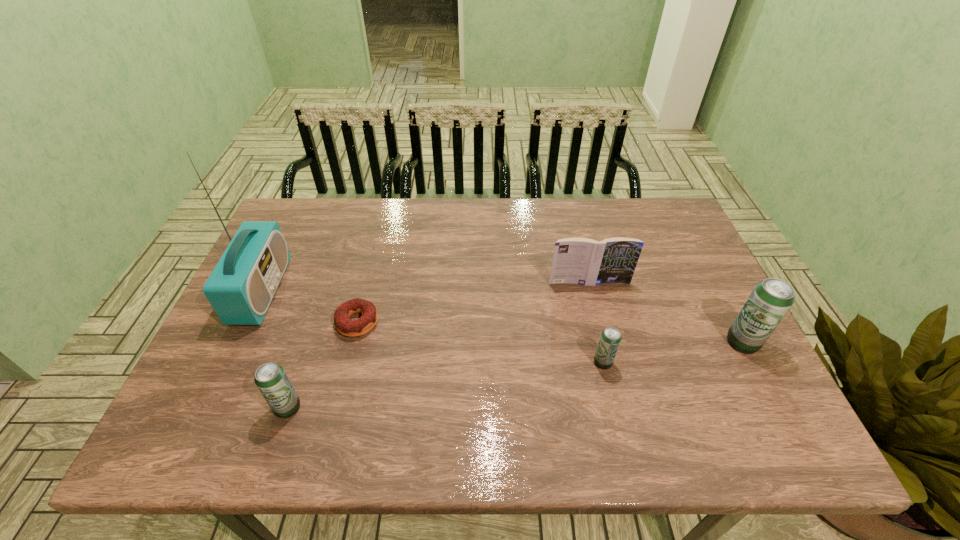
Find the location of a particular element. the nearest object is located at coordinates (270, 378).

Locate an element on the screen. Image resolution: width=960 pixels, height=540 pixels. the second tallest beer can is located at coordinates (270, 378).

Locate an element on the screen. the second beer can from left to right is located at coordinates (610, 339).

The width and height of the screenshot is (960, 540). Identify the location of the shortest beer can. (610, 339).

Find the location of a particular element. the tallest beer can is located at coordinates (770, 300).

In order to click on the rightmost object in this screenshot , I will do `click(770, 300)`.

You are a GUI agent. You are given a task and a screenshot of the screen. Output one action in this format:
    pyautogui.click(x=<x>, y=<y>)
    Task: Click on the third object from left to right
    The image size is (960, 540).
    Given the screenshot: What is the action you would take?
    pyautogui.click(x=352, y=328)

Where is `doughnut`? The width and height of the screenshot is (960, 540). doughnut is located at coordinates (352, 328).

What are the coordinates of `the tallest object` in the screenshot? It's located at (240, 289).

At what (x,y) coordinates should I click in order to perform the action: click on radio receiver. Please return your answer as a coordinate pair (x, y). The height and width of the screenshot is (540, 960). Looking at the image, I should click on (240, 289).